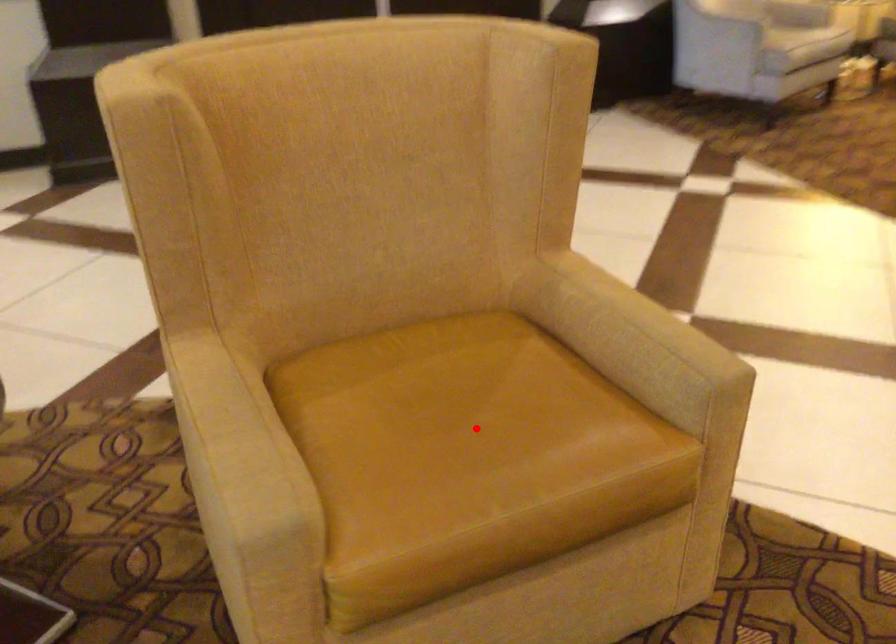
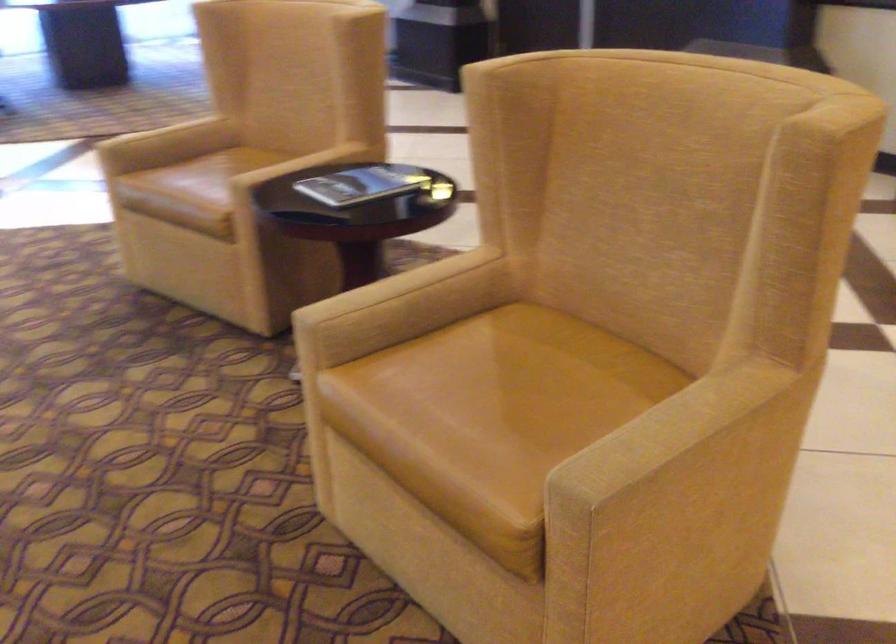
Where in the second image is the point corresponding to the highlighted location from the first image?

(500, 398)